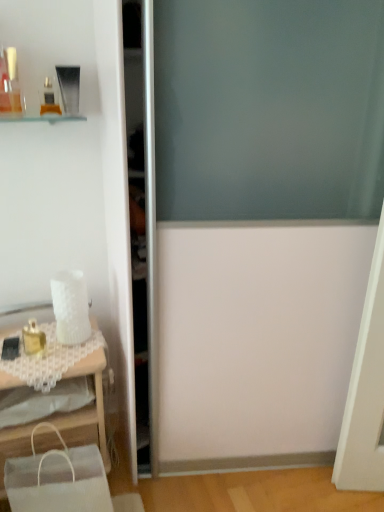
The width and height of the screenshot is (384, 512). In order to click on vacant area on top of white lace table at lower left (from a real-world perspective) in this screenshot , I will do `click(52, 349)`.